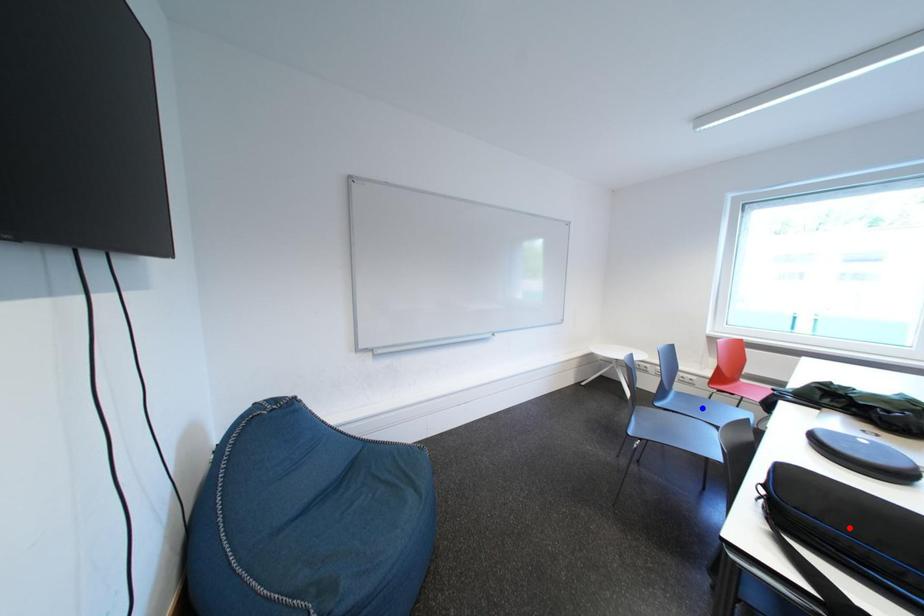
Question: Two points are marked on the image. Which point is closer to the camera?

Choices:
 (A) Blue point is closer.
 (B) Red point is closer.

Answer: (B)